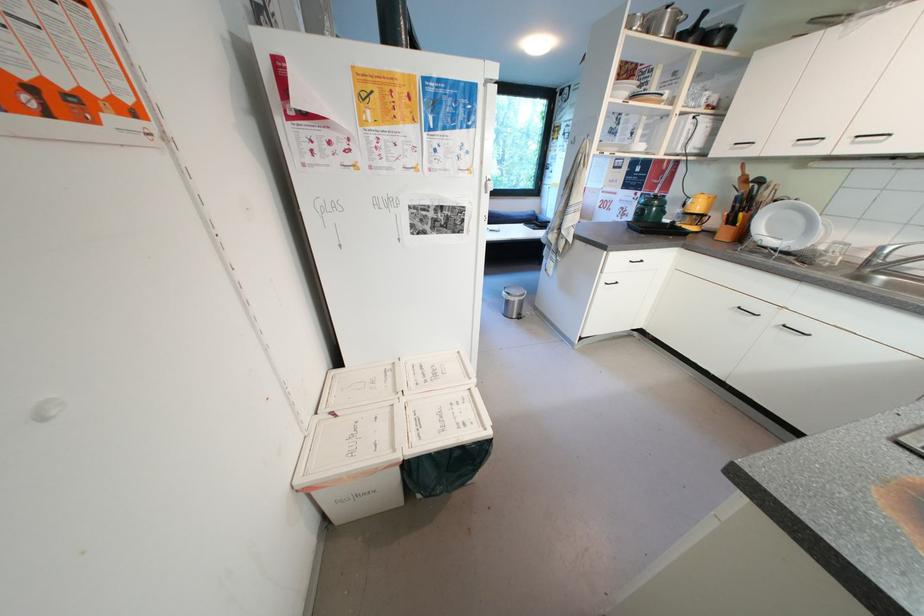
This screenshot has height=616, width=924. I want to click on black pan handle, so click(699, 18).